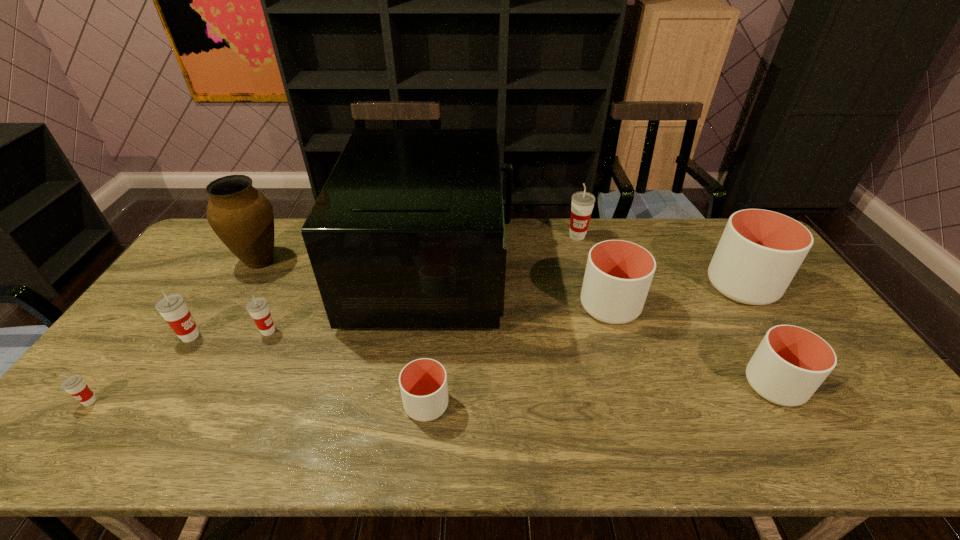
Identify the location of microwave_oven. (408, 232).

Image resolution: width=960 pixels, height=540 pixels. I want to click on the ninth shortest object, so click(242, 217).

Identify the location of brown urn. (242, 217).

You are a GUI agent. You are given a task and a screenshot of the screen. Output one action in this format:
    pyautogui.click(x=<x>, y=<y>)
    Task: Click on the biggest white cup
    This screenshot has width=960, height=540.
    Given the screenshot: What is the action you would take?
    pyautogui.click(x=760, y=251)

Locate an element on the screen. The width and height of the screenshot is (960, 540). the biggest red cup is located at coordinates (582, 204).

The image size is (960, 540). I want to click on the rightmost red cup, so [x=582, y=204].

Find the location of a particular element. the second biggest white cup is located at coordinates (618, 275).

The image size is (960, 540). I want to click on the second cup from left to right, so click(x=172, y=307).

Find the location of a particular element. This screenshot has height=540, width=960. the third red cup from right to left is located at coordinates pyautogui.click(x=172, y=307).

The height and width of the screenshot is (540, 960). In order to click on the seventh object from right to left in this screenshot , I will do `click(258, 308)`.